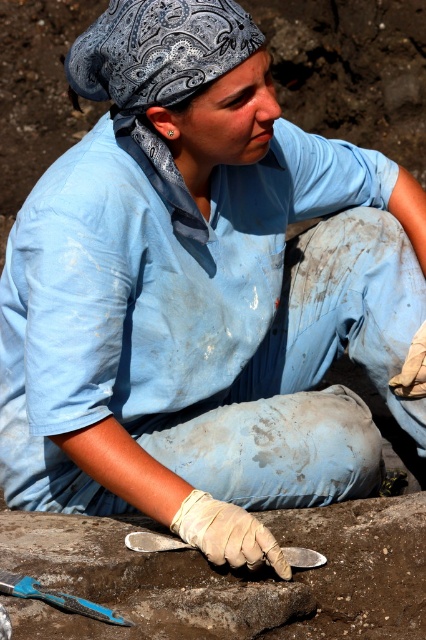
Question: Does smooth gray cement at lower center lie behind metallic silver trowel at center?

Choices:
 (A) yes
 (B) no

Answer: (B)

Question: Which point appears farthest from the camera in this image?

Choices:
 (A) (95, 536)
 (B) (126, 545)

Answer: (A)

Question: Can you confirm if blue plastic trowel at lower left is smaller than metallic silver trowel at center?

Choices:
 (A) yes
 (B) no

Answer: (B)

Question: Can you confirm if smooth gray cement at lower center is wider than metallic silver trowel at center?

Choices:
 (A) no
 (B) yes

Answer: (B)

Question: Which point appears farthest from the camera in this image?

Choices:
 (A) (342, 593)
 (B) (149, 541)
 (C) (13, 580)

Answer: (A)

Question: Which point is farther to the camera?

Choices:
 (A) smooth gray cement at lower center
 (B) blue plastic trowel at lower left
 (C) metallic silver trowel at center

Answer: (C)